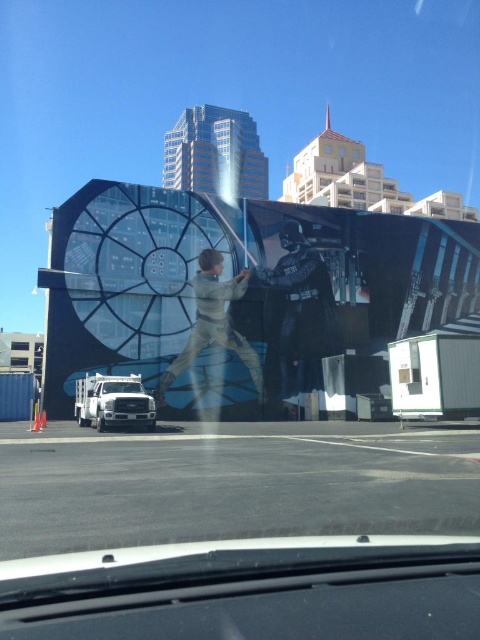
Question: Can you confirm if metallic silver armor at center is wider than white matte truck at center?

Choices:
 (A) yes
 (B) no

Answer: (B)

Question: Which of the following is the closest to the observer?

Choices:
 (A) light brown fabric at center
 (B) white matte truck at center

Answer: (B)

Question: Can you confirm if metallic silver armor at center is wider than white matte truck at center?

Choices:
 (A) yes
 (B) no

Answer: (B)

Question: Which of the following is the farthest from the observer?

Choices:
 (A) white matte truck at center
 (B) metallic silver armor at center
 (C) light brown fabric at center

Answer: (B)

Question: Which point appears closest to the camera in this image?

Choices:
 (A) (172, 372)
 (B) (291, 259)

Answer: (A)

Question: Can you confirm if metallic silver armor at center is positioned to the right of light brown fabric at center?

Choices:
 (A) yes
 (B) no

Answer: (A)